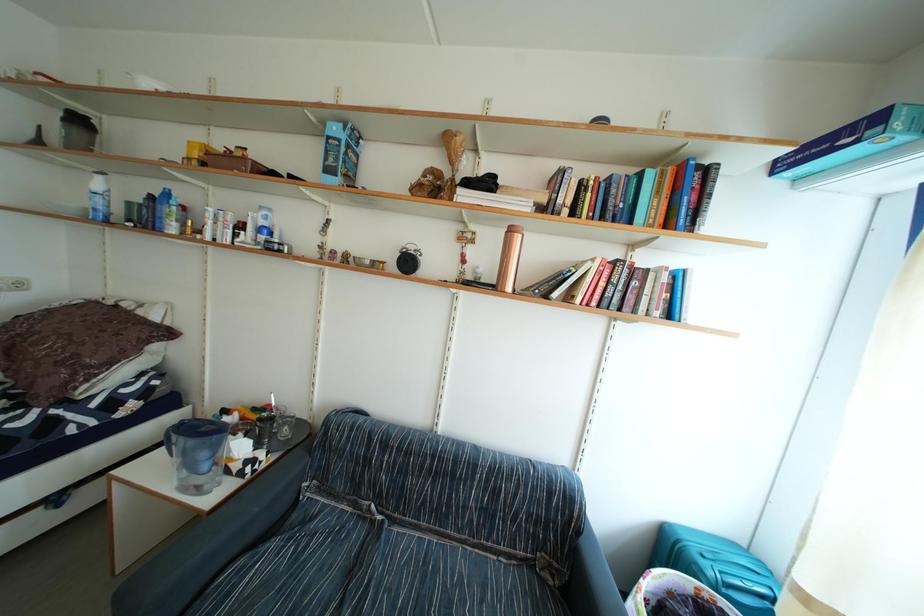
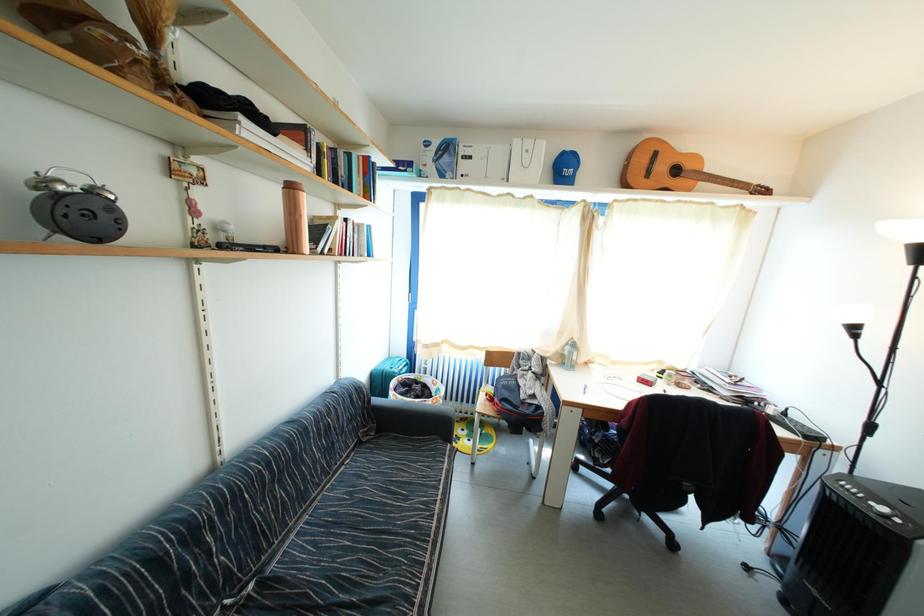
The images are taken continuously from a first-person perspective. In which direction is your viewpoint rotating?

The camera rotated toward right-down.